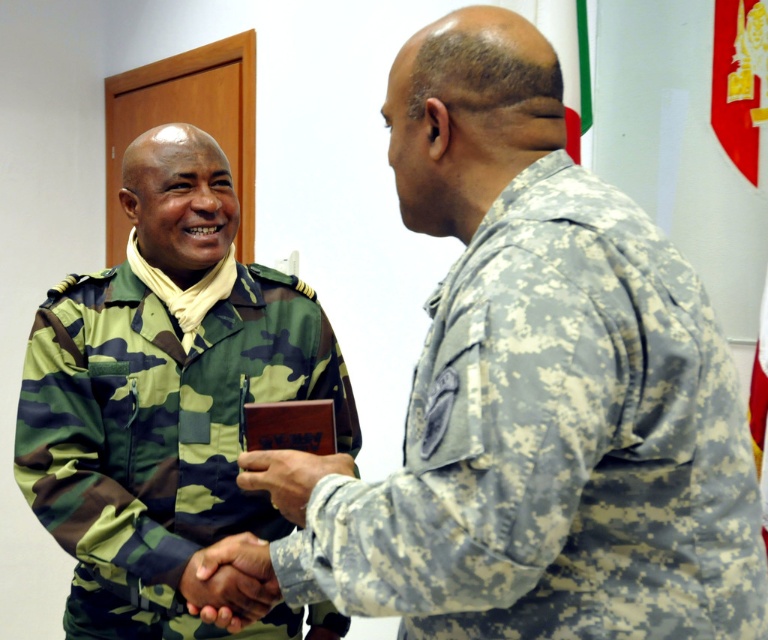
You are a photographer standing in front of the wooden door in the background. You want to take a photo of the camouflage fabric uniform at right and the dark skin textured hand at center. Which object is positioned closer to the door?

The camouflage fabric uniform at right is further away from the wooden door than the dark skin textured hand at center, so the dark skin textured hand at center is closer to the door.

Consider the image. You are a military photographer tasked with capturing a formal handshake between two officers. You notice that the camouflage fabric uniform at right and the camo fabric uniform at left are overlapping. Which uniform is covering part of the other?

The camouflage fabric uniform at right is positioned over the camo fabric uniform at left, meaning it is covering part of the other.

You are a photographer in a military ceremony. You need to arrange two soldiers in a photo. The camouflage fabric uniform at right and the camo fabric uniform at left must be positioned so that their heights are visible. Which soldier should stand in front to show the height difference?

The camouflage fabric uniform at right is not as tall as the camo fabric uniform at left, so the shorter soldier in camouflage fabric uniform at right should stand in front to highlight the height difference between them.